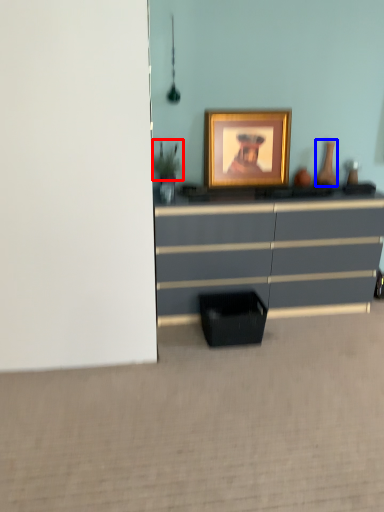
Question: Among these objects, which one is farthest to the camera, plant (highlighted by a red box) or vase (highlighted by a blue box)?

Choices:
 (A) plant
 (B) vase

Answer: (B)